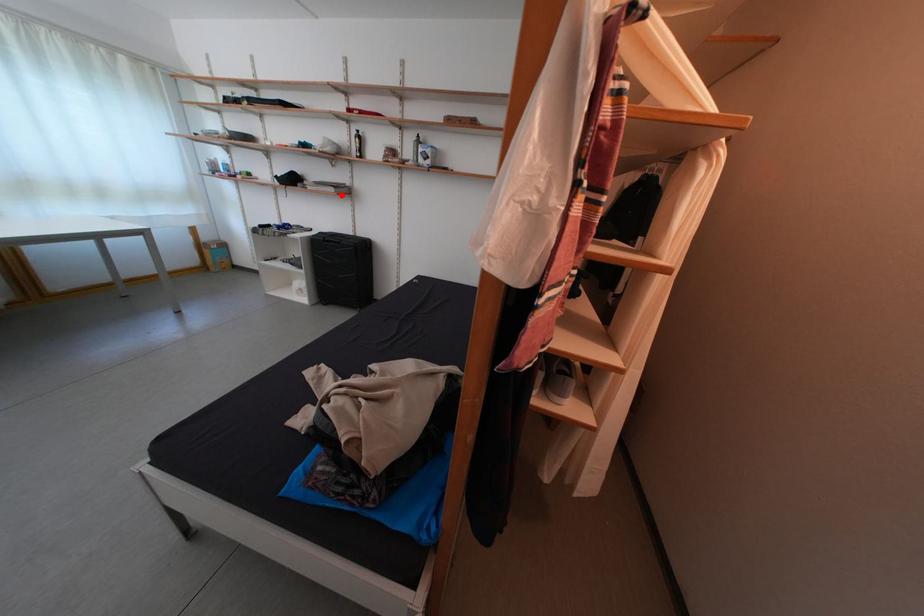
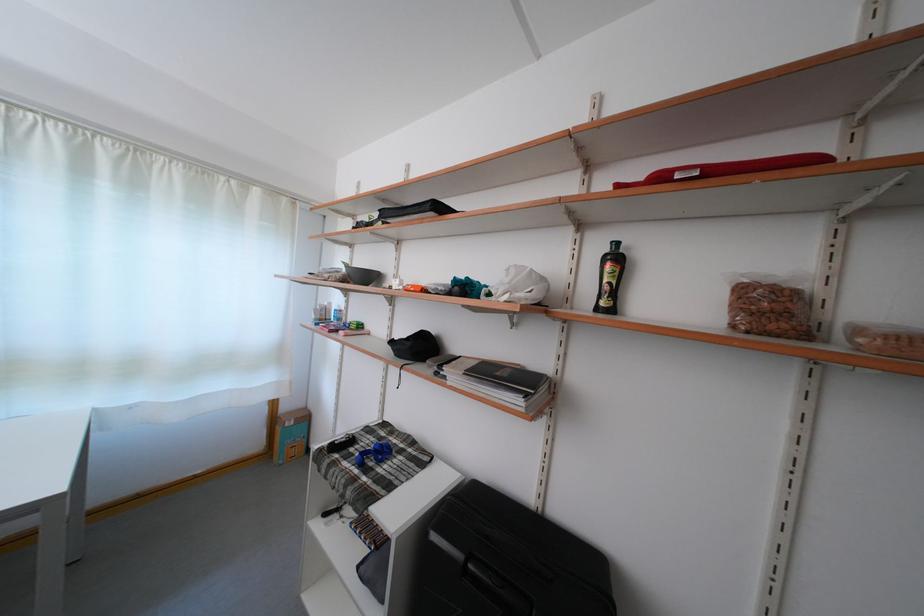
Question: I am providing you with two images of the same scene from different viewpoints. Given a red point in image1, look at the same physical point in image2. Is it:

Choices:
 (A) Closer to the viewpoint
 (B) Farther from the viewpoint

Answer: (B)